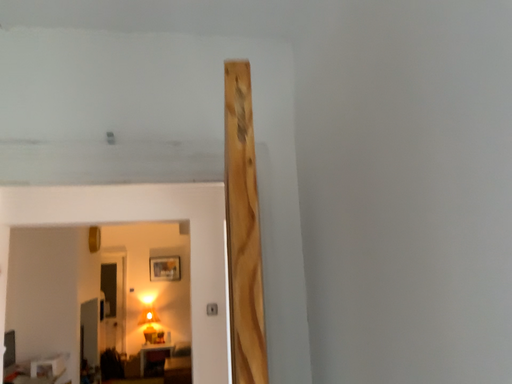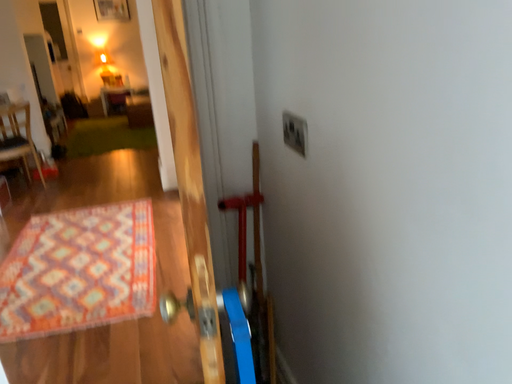
Question: How did the camera likely rotate when shooting the video?

Choices:
 (A) rotated downward
 (B) rotated upward

Answer: (A)